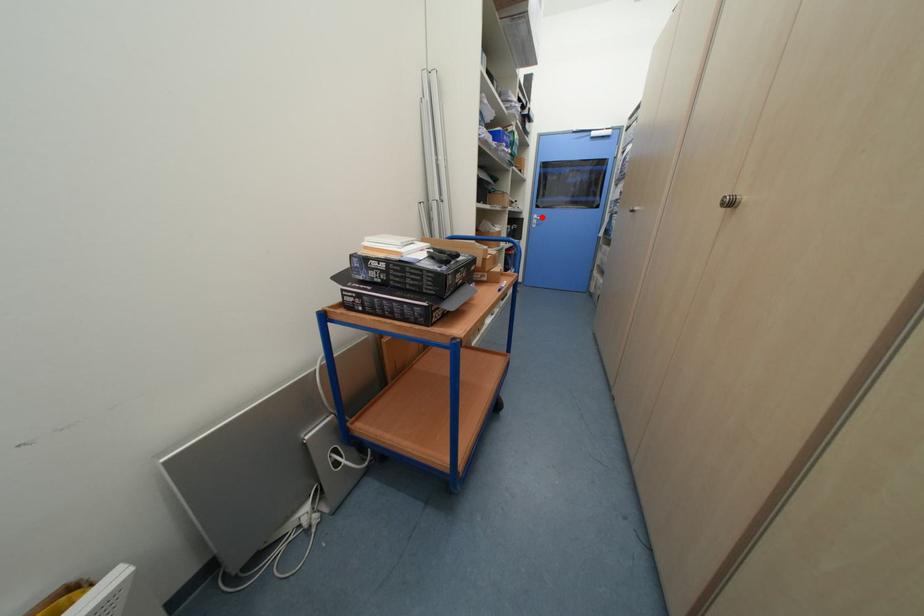
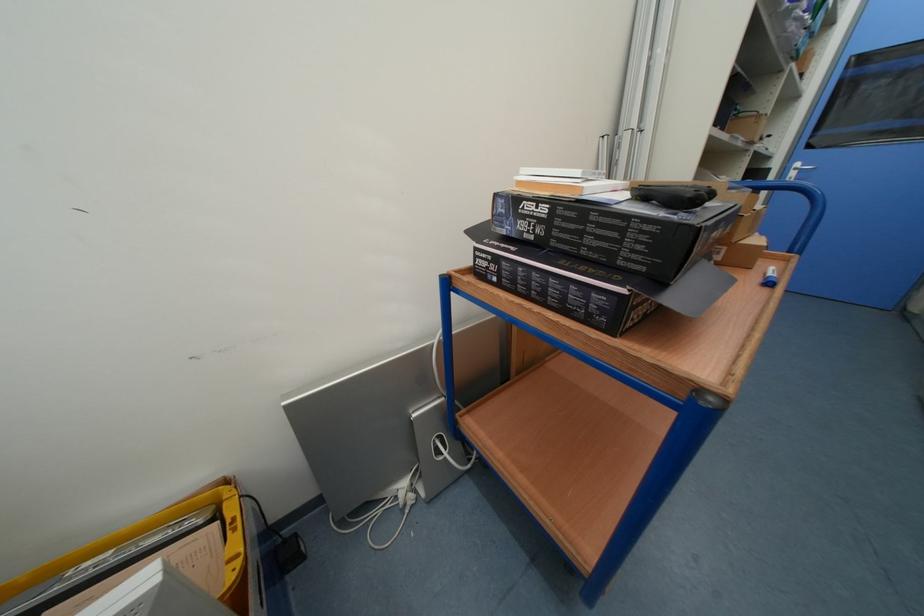
Question: I am providing you with two images of the same scene from different viewpoints. In image1, a red point is highlighted. Considering the same 3D point in image2, which of the following is correct?

Choices:
 (A) It is closer
 (B) It is farther

Answer: (B)